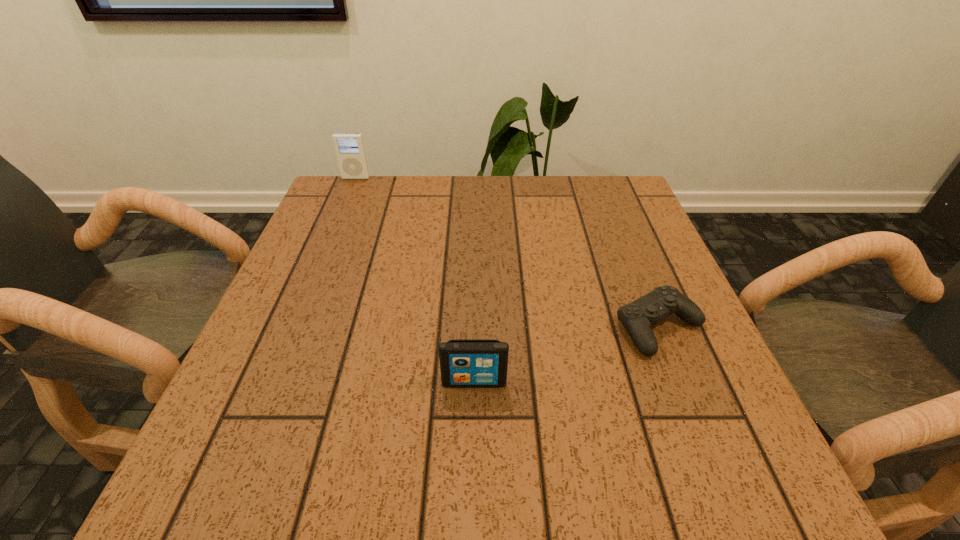
Find the location of a particular element. Image resolution: width=960 pixels, height=540 pixels. the leftmost object is located at coordinates (349, 147).

Identify the location of the taller iPod. (349, 147).

You are a GUI agent. You are given a task and a screenshot of the screen. Output one action in this format:
    pyautogui.click(x=<x>, y=<y>)
    Task: Click on the nearer iPod
    
    Given the screenshot: What is the action you would take?
    pyautogui.click(x=464, y=363)

Locate an element on the screen. Image resolution: width=960 pixels, height=540 pixels. the shorter iPod is located at coordinates (464, 363).

Where is `the shortest object`? The image size is (960, 540). the shortest object is located at coordinates (637, 317).

Locate an element on the screen. The width and height of the screenshot is (960, 540). the rightmost object is located at coordinates (637, 317).

You are a GUI agent. You are given a task and a screenshot of the screen. Output one action in this format:
    pyautogui.click(x=<x>, y=<y>)
    Task: Click on the vacant space located 0.130m on the front-facing side of the taller iPod
    The image size is (960, 540).
    Given the screenshot: What is the action you would take?
    tap(345, 205)

You are a GUI agent. You are given a task and a screenshot of the screen. Output one action in this format:
    pyautogui.click(x=<x>, y=<y>)
    Task: Click on the vacant space located on the front screen of the shorter iPod
    The width and height of the screenshot is (960, 540).
    Given the screenshot: What is the action you would take?
    pyautogui.click(x=473, y=484)

Where is `free space located 0.270m on the back of the second nearest object`? The width and height of the screenshot is (960, 540). free space located 0.270m on the back of the second nearest object is located at coordinates (617, 223).

At what (x,y) coordinates should I click in order to perform the action: click on object located at the far edge. Please return your answer as a coordinate pair (x, y). This screenshot has width=960, height=540. Looking at the image, I should click on pyautogui.click(x=349, y=147).